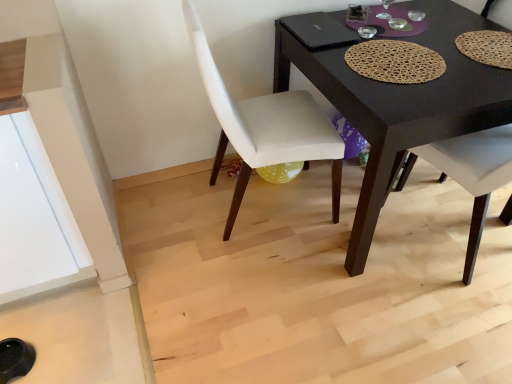
You are a GUI agent. You are given a task and a screenshot of the screen. Output one action in this format:
    pyautogui.click(x=<x>, y=<y>)
    Task: Click on the free space in front of white fabric chair at center, arranged as the 1th chair when viewed from the left
    
    Given the screenshot: What is the action you would take?
    pyautogui.click(x=267, y=282)